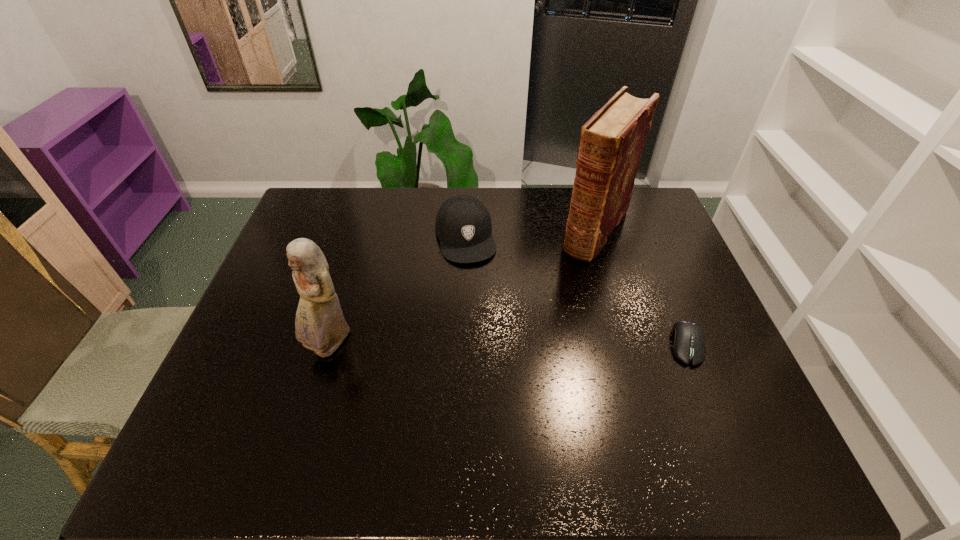
Locate an element on the screen. This screenshot has width=960, height=540. free space between the third object from right to left and the tallest object is located at coordinates (531, 233).

I want to click on vacant area that lies between the second object from left to right and the computer equipment, so click(576, 291).

At what (x,y) coordinates should I click in order to perform the action: click on empty location between the cap and the hardback book. Please return your answer as a coordinate pair (x, y). The width and height of the screenshot is (960, 540). Looking at the image, I should click on (531, 233).

The image size is (960, 540). What are the coordinates of `empty space between the figurine and the second object from left to right` in the screenshot? It's located at (397, 292).

The image size is (960, 540). What are the coordinates of `free point between the figurine and the cap` in the screenshot? It's located at (397, 292).

Identify the location of object that is the third closest to the third object from right to left. This screenshot has width=960, height=540. (688, 338).

Locate which object is the third closest to the tallest object. Please provide its 2D coordinates. Your answer should be formatted as a tuple, i.e. [(x, y)], where the tuple contains the x and y coordinates of a point satisfying the conditions above.

[(320, 326)]

The height and width of the screenshot is (540, 960). Identify the location of free space that satisfies the following two spatial constraints: 1. on the back side of the cap; 2. on the right side of the tallest object. (466, 230).

In order to click on free spot that satisfies the following two spatial constraints: 1. on the front side of the third object from right to left; 2. on the right side of the shortest object in this screenshot , I will do `click(461, 345)`.